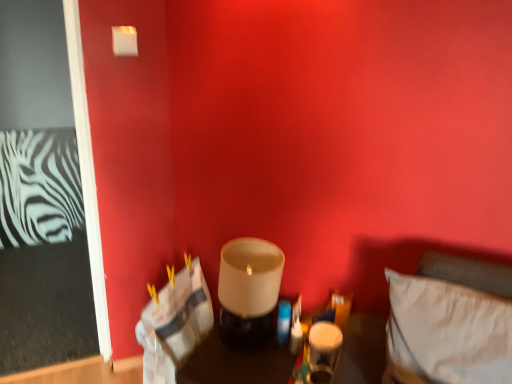
Question: Is point (269, 317) positioned closer to the camera than point (313, 380)?

Choices:
 (A) closer
 (B) farther

Answer: (B)

Question: In terms of width, does matte white glass at center, marked as the second candle holder in a right-to-left arrangement, look wider or thinner when compared to matte white glass at lower center, marked as the second candle holder in a left-to-right arrangement?

Choices:
 (A) wide
 (B) thin

Answer: (A)

Question: Which object is positioned farthest from the matte white glass at lower center, the first candle holder in the right-to-left sequence?

Choices:
 (A) matte white glass at center, placed as the first candle holder when sorted from left to right
 (B) translucent glass candle holder at center
 (C) white fabric pillow at lower right

Answer: (C)

Question: Which is nearer to the matte white glass at center, marked as the second candle holder in a right-to-left arrangement?

Choices:
 (A) white fabric pillow at lower right
 (B) translucent glass candle holder at center
 (C) matte white glass at lower center, the first candle holder in the right-to-left sequence

Answer: (B)